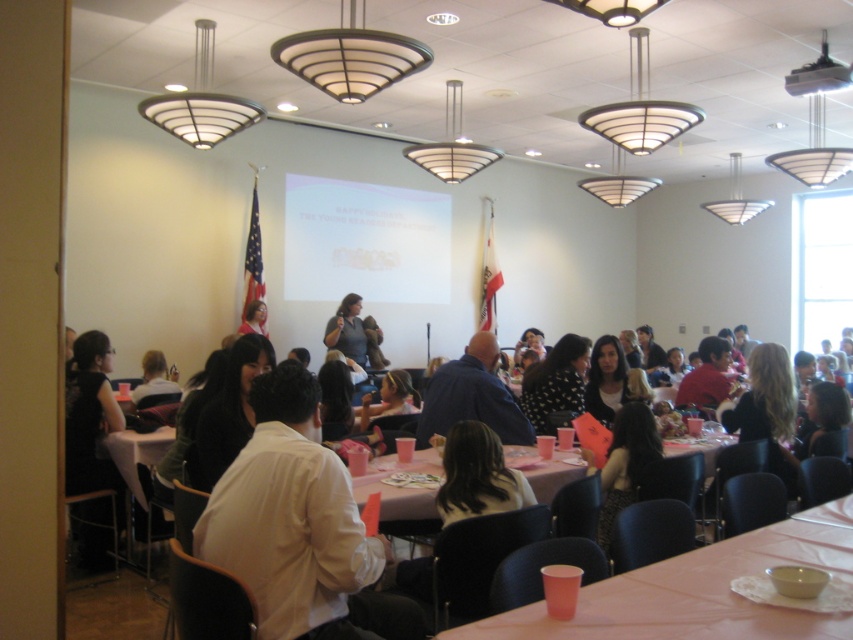
Which is behind, point (792, 88) or point (258, 324)?

The point (258, 324) is more distant.

Locate an element on the screen. The width and height of the screenshot is (853, 640). metallic projector at upper center is located at coordinates (817, 76).

The width and height of the screenshot is (853, 640). Identify the location of metallic projector at upper center. (817, 76).

Can you confirm if blue shirt at center is positioned to the left of matte gray sweater at center?

No, blue shirt at center is not to the left of matte gray sweater at center.

Does point (468, 368) come closer to viewer compared to point (346, 339)?

Yes.

At what (x,y) coordinates should I click in order to perform the action: click on blue shirt at center. Please return your answer as a coordinate pair (x, y). The height and width of the screenshot is (640, 853). Looking at the image, I should click on (473, 396).

What do you see at coordinates (698, 589) in the screenshot?
I see `pink plastic cup at lower center` at bounding box center [698, 589].

Can you confirm if pink plastic cup at lower center is shorter than blue shirt at center?

Indeed, pink plastic cup at lower center has a lesser height compared to blue shirt at center.

Identify the location of pink plastic cup at lower center. (698, 589).